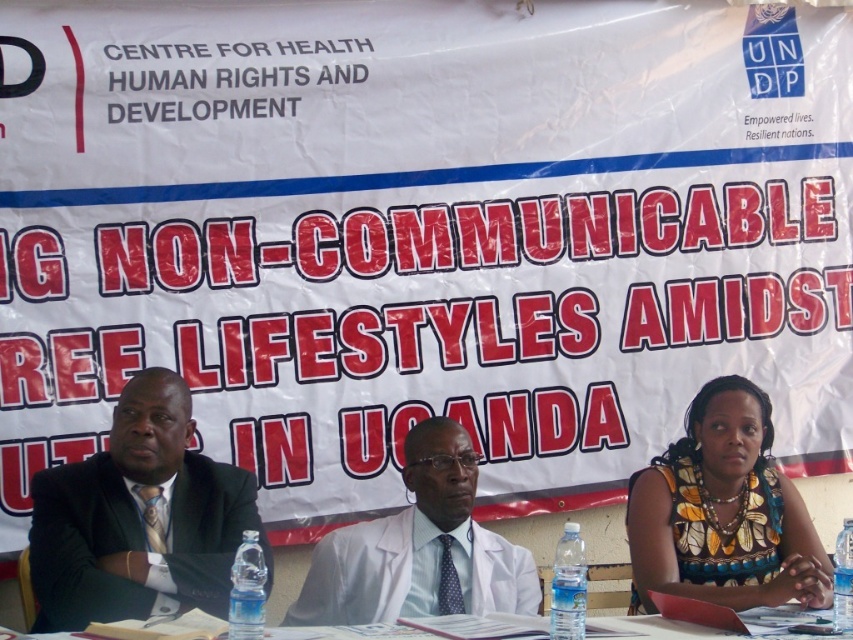
Question: Which point is closer to the camera?

Choices:
 (A) white lab coat at center
 (B) floral fabric dress at lower right
 (C) clear plastic water bottles at lower center

Answer: (C)

Question: Does black suit at left lie behind floral fabric dress at lower right?

Choices:
 (A) yes
 (B) no

Answer: (A)

Question: Does white lab coat at center have a greater width compared to clear plastic water bottles at lower center?

Choices:
 (A) yes
 (B) no

Answer: (B)

Question: Which of these objects is positioned closest to the clear plastic water bottles at lower center?

Choices:
 (A) white lab coat at center
 (B) floral fabric dress at lower right
 (C) black suit at left

Answer: (A)

Question: Can you confirm if black suit at left is positioned below white lab coat at center?

Choices:
 (A) yes
 (B) no

Answer: (B)

Question: Which object appears farthest from the camera in this image?

Choices:
 (A) floral fabric dress at lower right
 (B) black suit at left

Answer: (B)